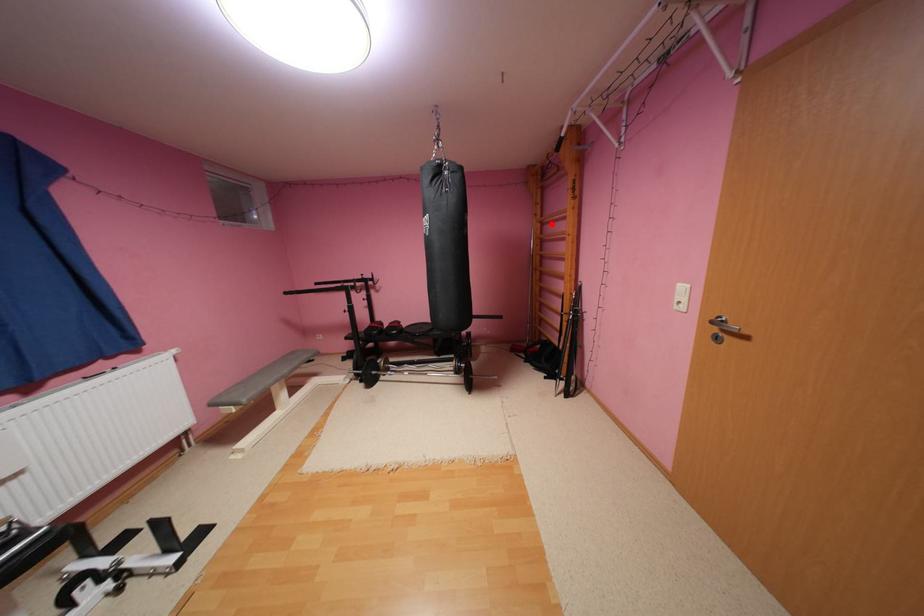
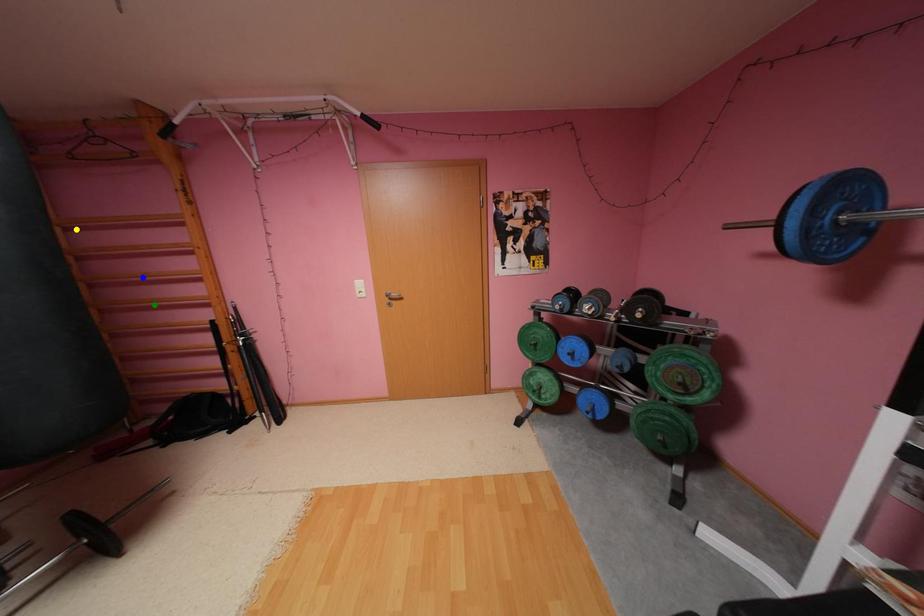
Question: I am providing you with two images of the same scene from different viewpoints. A red point is marked on the first image. You are given multiple points on the second image. Which mark in image 2 goes with the point in image 1?

Choices:
 (A) yellow point
 (B) green point
 (C) blue point

Answer: (A)